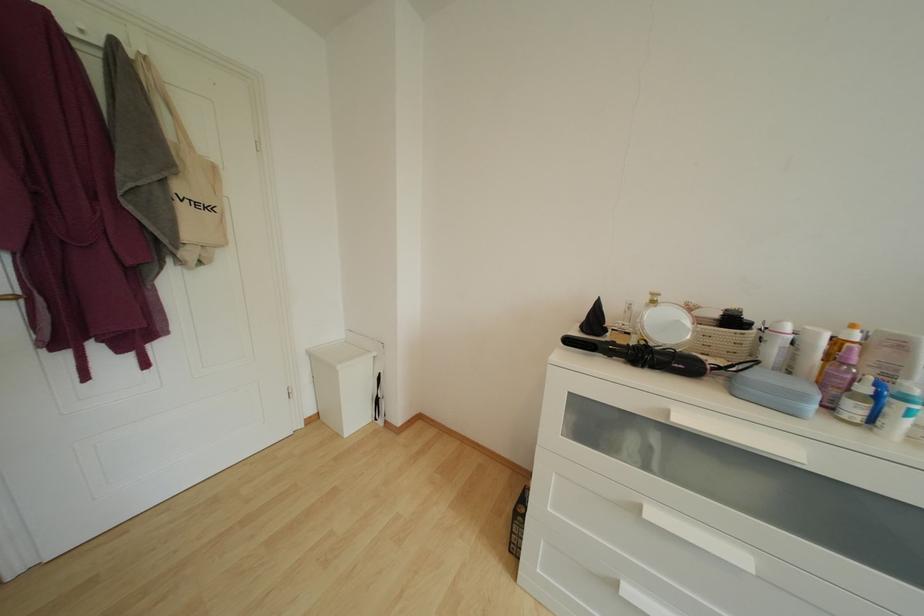
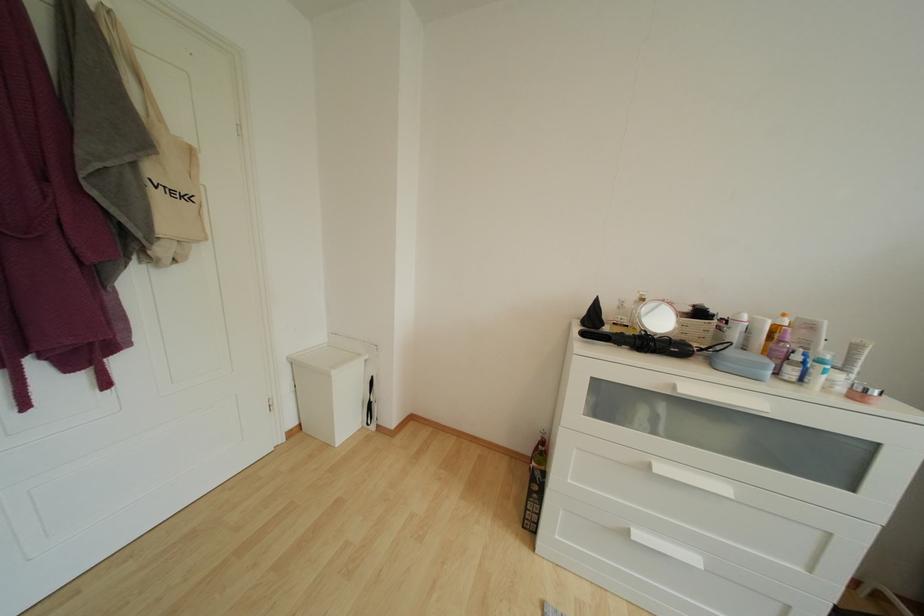
Find the pixel in the second image that matches pixel 150 62 in the first image.

(114, 15)